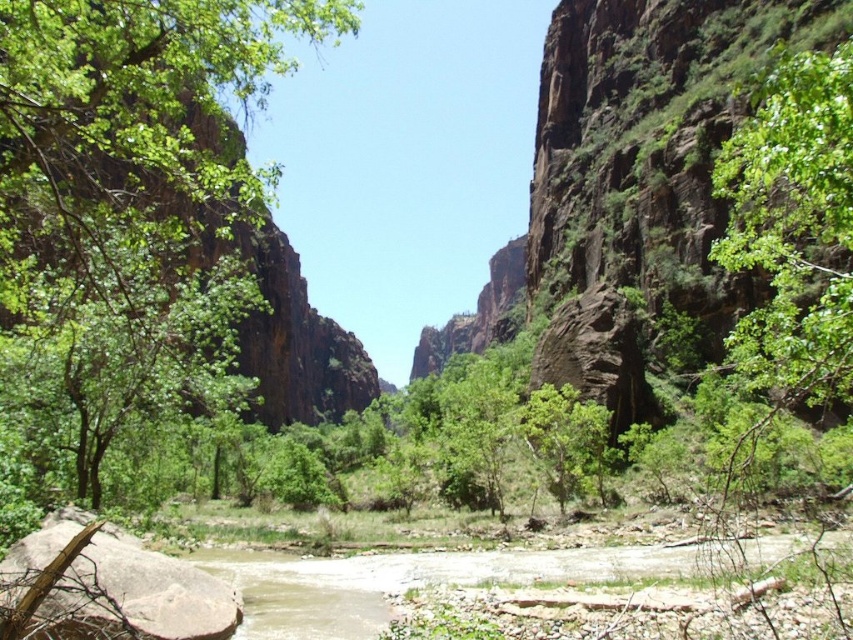
Question: Is green leafy tree at left above green leafy tree at center?

Choices:
 (A) yes
 (B) no

Answer: (A)

Question: Which point is farther to the camera?

Choices:
 (A) green leafy tree at left
 (B) green leafy tree at center

Answer: (B)

Question: Can you confirm if brown rough rock at lower left is positioned below green leafy tree at center?

Choices:
 (A) yes
 (B) no

Answer: (B)

Question: Does brown rough rock at lower left have a larger size compared to green leafy tree at center?

Choices:
 (A) yes
 (B) no

Answer: (B)

Question: Which object is positioned closest to the green leafy tree at center?

Choices:
 (A) green leafy tree at left
 (B) brown rough rock at lower left

Answer: (A)

Question: Which point is farther from the camera taking this photo?

Choices:
 (A) (781, 100)
 (B) (82, 628)
 (C) (230, 225)

Answer: (C)